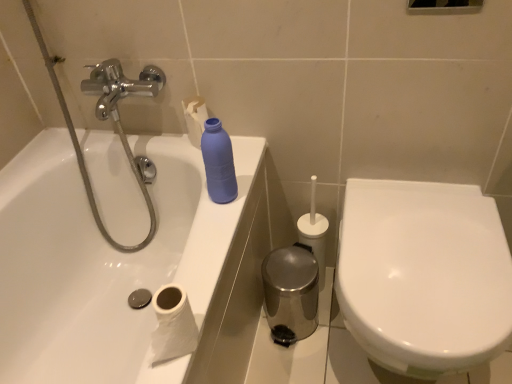
Question: Looking at their shapes, would you say white paper at lower left is wider or thinner than matte blue plastic bottle at upper center?

Choices:
 (A) wide
 (B) thin

Answer: (A)

Question: Considering their positions, is white paper at lower left located in front of or behind matte blue plastic bottle at upper center?

Choices:
 (A) behind
 (B) front

Answer: (B)

Question: Which object is the closest to the white paper at lower left?

Choices:
 (A) matte blue plastic bottle at upper center
 (B) white glossy toilet at right

Answer: (A)

Question: Estimate the real-world distances between objects in this image. Which object is farther from the white paper at lower left?

Choices:
 (A) matte blue plastic bottle at upper center
 (B) white glossy toilet at right

Answer: (B)